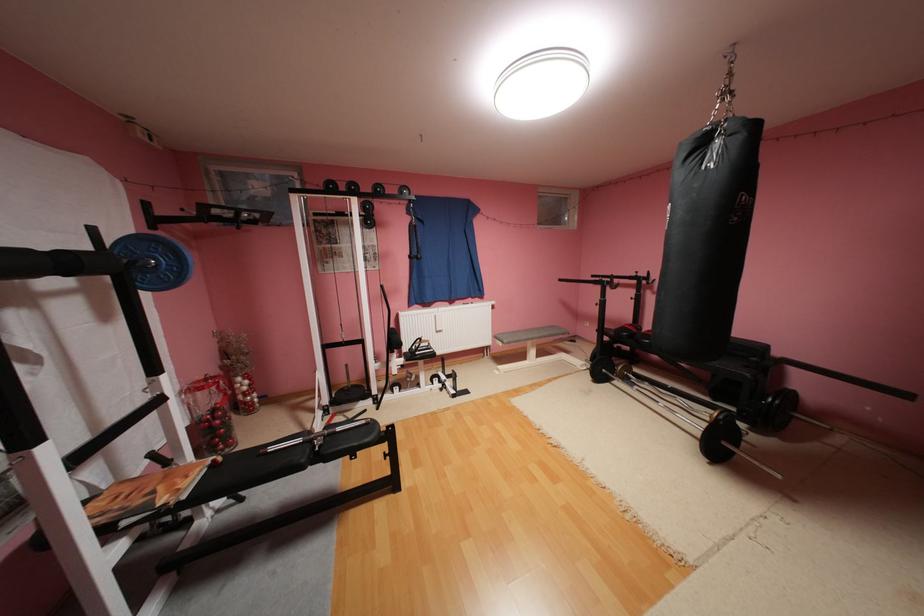
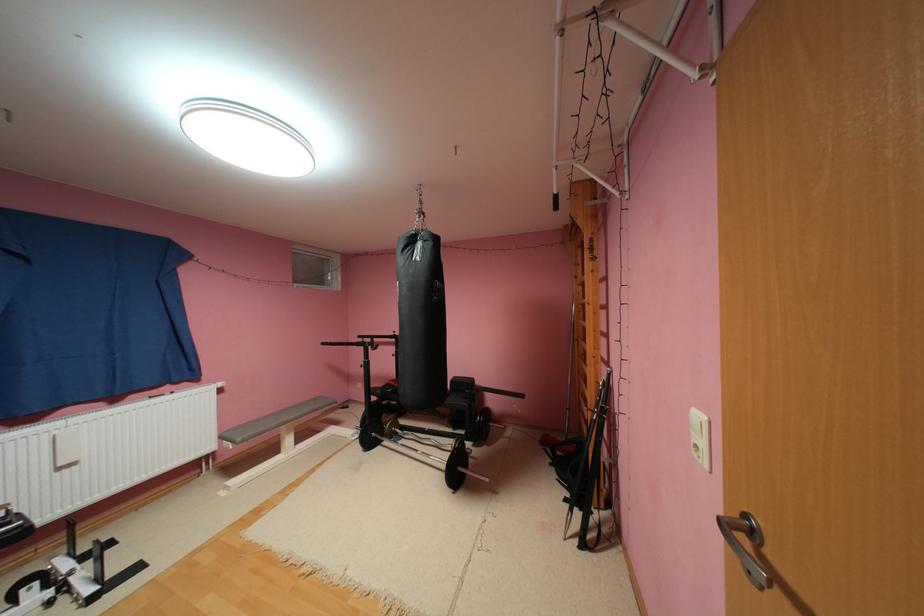
Find the pixel in the second image that matches point (642, 274) in the first image.

(400, 334)